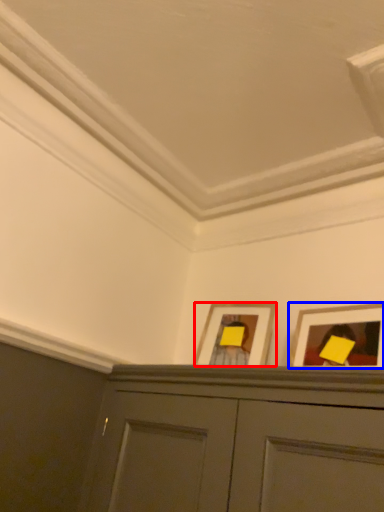
Question: Which object appears closest to the camera in this image, picture frame (highlighted by a red box) or picture frame (highlighted by a blue box)?

Choices:
 (A) picture frame
 (B) picture frame

Answer: (B)